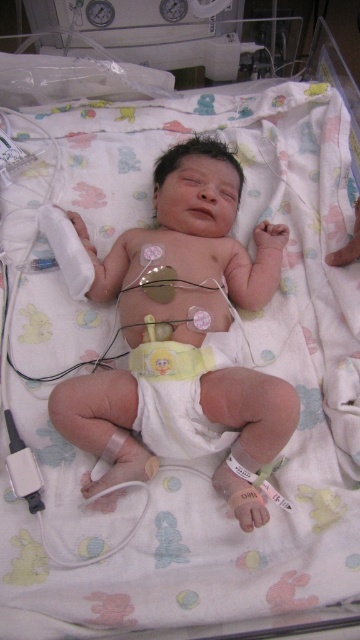
You are a nurse in the neonatal unit. You need to place a teething ring at center and a white soft diaper at center on a tray for the baby. The tray has limited space. Which item should you place first to ensure both items fit properly?

The white soft diaper at center has a larger size compared to the teething ring at center, so you should place the white soft diaper at center first to ensure both items fit on the tray.